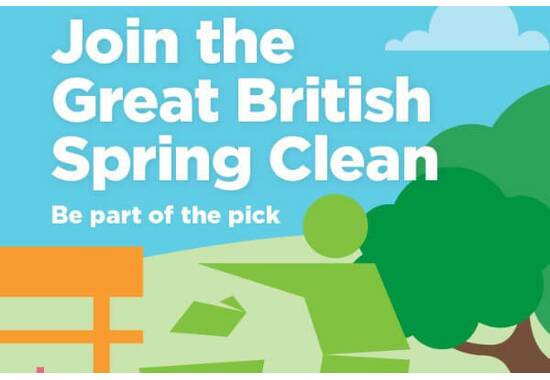
You are a GUI agent. You are given a task and a screenshot of the screen. Output one action in this format:
    pyautogui.click(x=<x>, y=<y>)
    Task: Click on the bench
    
    Given the screenshot: What is the action you would take?
    pyautogui.click(x=36, y=274)